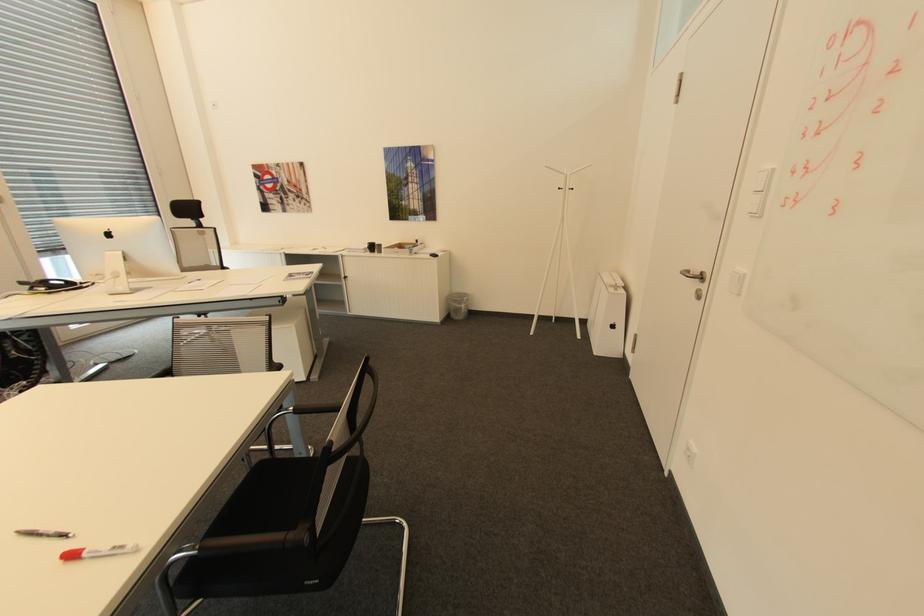
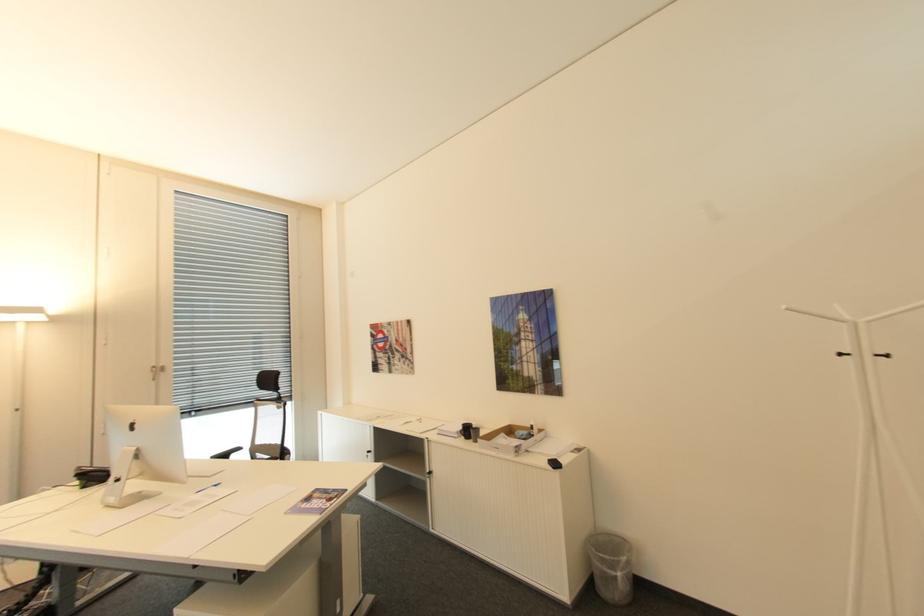
Where in the second image is the point corresponding to point (564, 188) from the first image?

(846, 355)